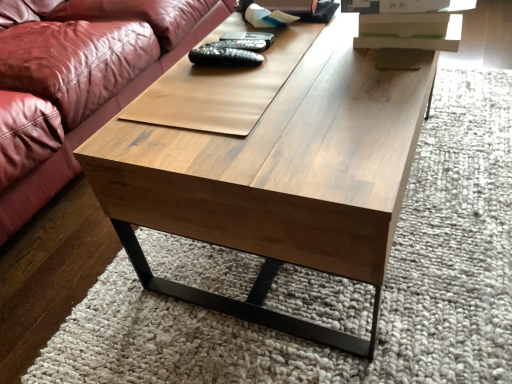
I want to click on vacant area that lies to the right of black plastic remote at center, the 3th remote ordered from the bottom, so click(x=314, y=40).